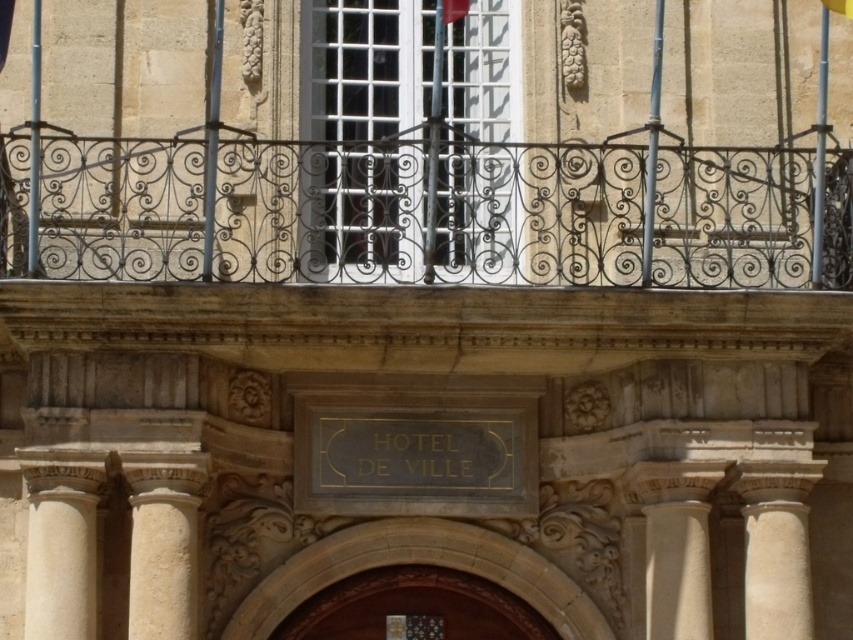
Question: Which point is farther from the camera taking this photo?

Choices:
 (A) (712, 182)
 (B) (683, 477)
 (C) (351, 625)

Answer: (A)

Question: Can you confirm if white marble column at lower left is bigger than yellow fabric flag at upper center?

Choices:
 (A) yes
 (B) no

Answer: (A)

Question: Which point appears closest to the camera in this image?

Choices:
 (A) (442, 3)
 (B) (682, 573)
 (C) (80, 604)
 (D) (338, 584)

Answer: (C)

Question: Does white marble column at lower left appear under white stone column at center?

Choices:
 (A) yes
 (B) no

Answer: (B)

Question: Which is farther from the white stone column at center?

Choices:
 (A) beige stone column at center
 (B) wooden door at center
 (C) white marble column at lower left
 (D) polished wrought iron balcony at upper center

Answer: (C)

Question: Can you confirm if white stone column at center is smaller than yellow fabric flag at upper center?

Choices:
 (A) no
 (B) yes

Answer: (A)